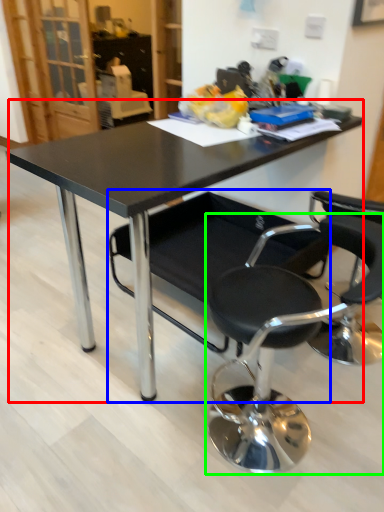
Question: Considering the real-world distances, which object is closest to table (highlighted by a red box)? chair (highlighted by a blue box) or chair (highlighted by a green box).

Choices:
 (A) chair
 (B) chair

Answer: (A)